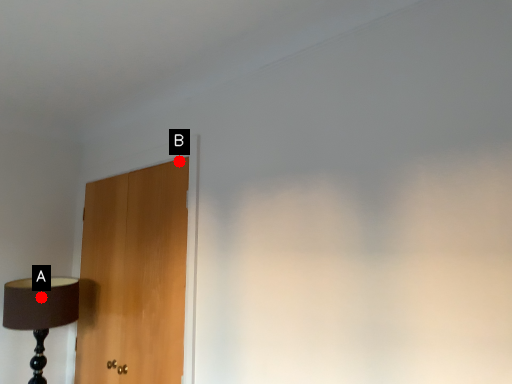
Question: Two points are circled on the image, labeled by A and B beside each circle. Which of the following is the farthest from the observer?

Choices:
 (A) A is further
 (B) B is further

Answer: (A)